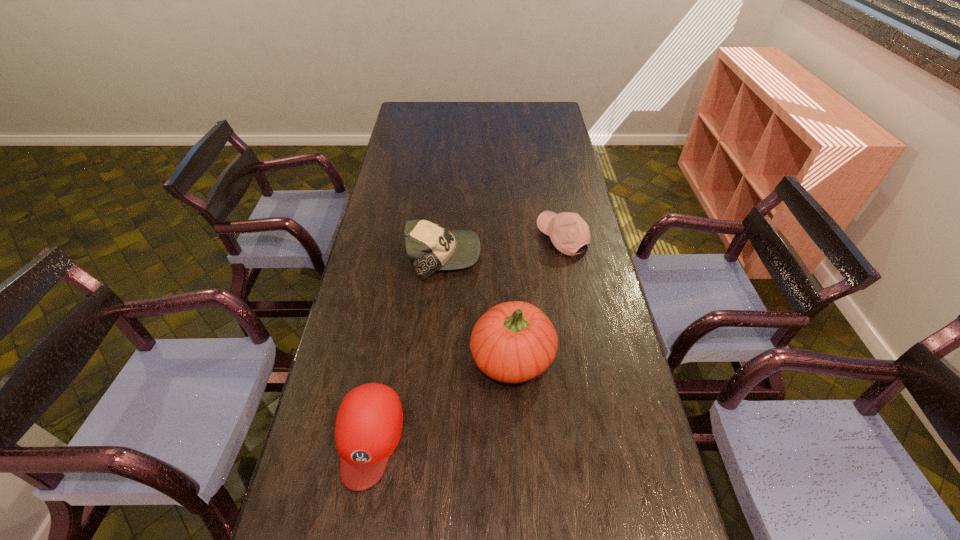
At what (x,y) coordinates should I click in order to perform the action: click on free space at the left edge of the desktop. Please return your answer as a coordinate pair (x, y). Looking at the image, I should click on (409, 134).

This screenshot has height=540, width=960. I want to click on free space at the right edge of the desktop, so click(x=537, y=151).

I want to click on vacant space at the far left corner, so click(x=422, y=117).

You are a GUI agent. You are given a task and a screenshot of the screen. Output one action in this format:
    pyautogui.click(x=<x>, y=<y>)
    Task: Click on the free region at the far right corner of the desktop
    The image size is (960, 540).
    Given the screenshot: What is the action you would take?
    pyautogui.click(x=542, y=120)

In order to click on unoccupied position between the pumpkin and the rightmost baseball cap in this screenshot , I will do `click(538, 298)`.

You are a GUI agent. You are given a task and a screenshot of the screen. Output one action in this format:
    pyautogui.click(x=<x>, y=<y>)
    Task: Click on the free space between the rightmost baseball cap and the tallest object
    
    Given the screenshot: What is the action you would take?
    pyautogui.click(x=538, y=298)

You are a GUI agent. You are given a task and a screenshot of the screen. Output one action in this format:
    pyautogui.click(x=<x>, y=<y>)
    Task: Click on the free space that is in between the nearest baseball cap and the rightmost baseball cap
    This screenshot has height=540, width=960.
    Given the screenshot: What is the action you would take?
    pyautogui.click(x=466, y=338)

The height and width of the screenshot is (540, 960). Find the location of `vacant region between the pumpkin and the nearest baseball cap`. vacant region between the pumpkin and the nearest baseball cap is located at coordinates (441, 397).

In order to click on free space that is in between the rightmost baseball cap and the tallest object in this screenshot , I will do `click(538, 298)`.

Identify the location of free space between the tallest object and the nearest baseball cap. Image resolution: width=960 pixels, height=540 pixels. (441, 397).